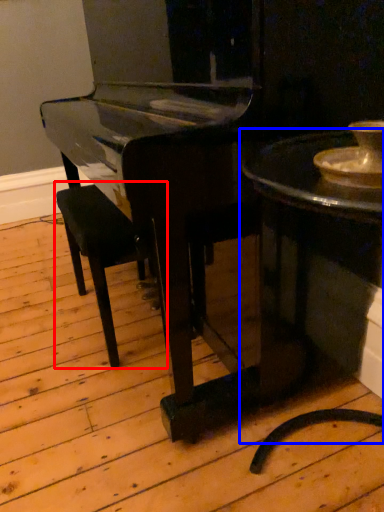
Question: Which object is further to the camera taking this photo, armchair (highlighted by a red box) or table (highlighted by a blue box)?

Choices:
 (A) armchair
 (B) table

Answer: (A)